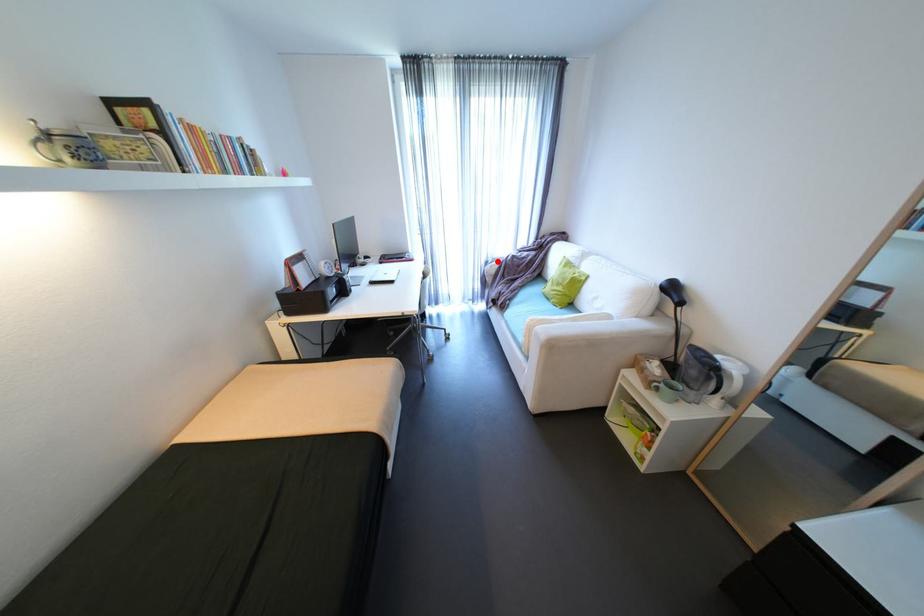
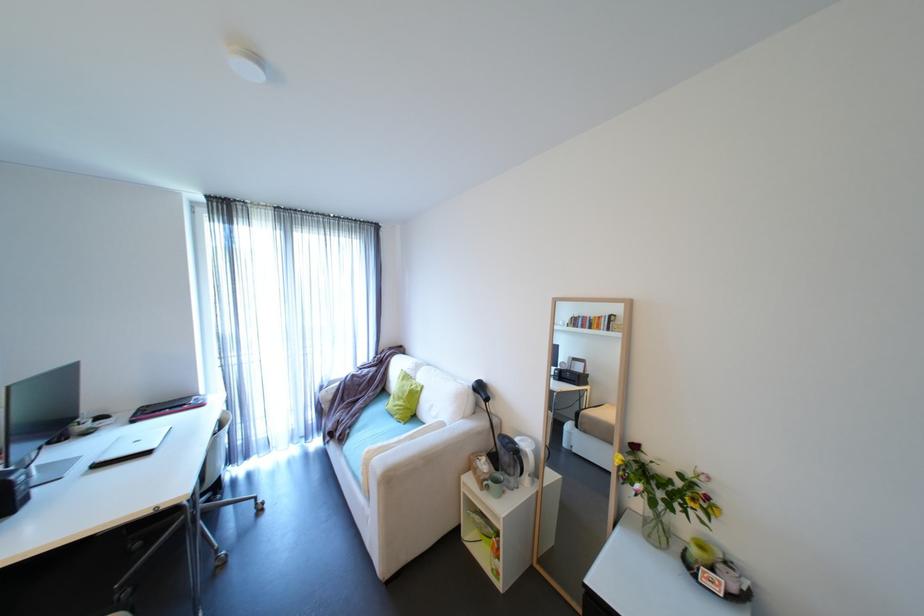
Where in the second image is the point corresponding to the highlighted location from the first image?

(333, 386)